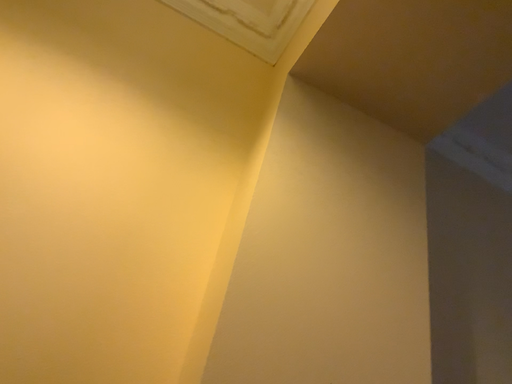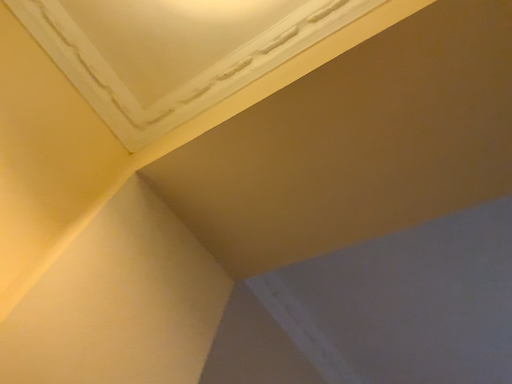
Question: How did the camera likely rotate when shooting the video?

Choices:
 (A) rotated upward
 (B) rotated downward

Answer: (A)